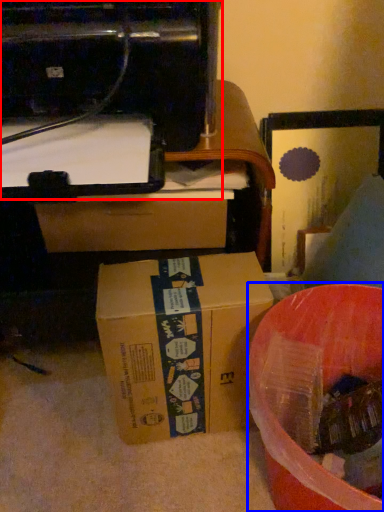
Question: Which of the following is the closest to the observer, printer (highlighted by a red box) or waste (highlighted by a blue box)?

Choices:
 (A) printer
 (B) waste

Answer: (A)